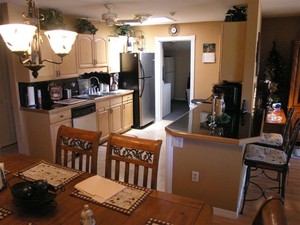
Locate an element on the screen. The image size is (300, 225). wood floor is located at coordinates coord(289,193).